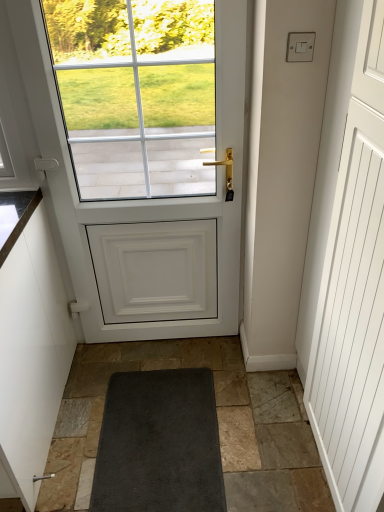
Question: Is white matte cabinet at left oriented away from white matte door at center?

Choices:
 (A) no
 (B) yes

Answer: (A)

Question: Is white matte cabinet at left behind white matte door at center?

Choices:
 (A) yes
 (B) no

Answer: (B)

Question: From a real-world perspective, is white matte cabinet at left positioned under white matte door at center based on gravity?

Choices:
 (A) yes
 (B) no

Answer: (A)

Question: Is white matte cabinet at left wider than white matte door at center?

Choices:
 (A) yes
 (B) no

Answer: (A)

Question: Is white matte cabinet at left placed right next to white matte door at center?

Choices:
 (A) yes
 (B) no

Answer: (B)

Question: Is white matte cabinet at left to the left or to the right of white matte door at center in the image?

Choices:
 (A) left
 (B) right

Answer: (A)

Question: Which is correct: white matte cabinet at left is inside white matte door at center, or outside of it?

Choices:
 (A) inside
 (B) outside

Answer: (B)

Question: Is white matte cabinet at left taller or shorter than white matte door at center?

Choices:
 (A) tall
 (B) short

Answer: (B)

Question: Looking at their shapes, would you say white matte cabinet at left is wider or thinner than white matte door at center?

Choices:
 (A) thin
 (B) wide

Answer: (B)

Question: Considering the positions of white matte door at center and white plastic switch at upper right in the image, is white matte door at center bigger or smaller than white plastic switch at upper right?

Choices:
 (A) big
 (B) small

Answer: (A)

Question: From their relative heights in the image, would you say white matte door at center is taller or shorter than white plastic switch at upper right?

Choices:
 (A) tall
 (B) short

Answer: (A)

Question: Considering the relative positions of white matte door at center and white plastic switch at upper right in the image provided, is white matte door at center to the left or to the right of white plastic switch at upper right?

Choices:
 (A) left
 (B) right

Answer: (A)

Question: From a real-world perspective, is white matte door at center above or below white plastic switch at upper right?

Choices:
 (A) above
 (B) below

Answer: (B)

Question: Considering their positions, is white plastic switch at upper right located in front of or behind white matte door at center?

Choices:
 (A) front
 (B) behind

Answer: (A)

Question: From a real-world perspective, is white plastic switch at upper right physically located above or below white matte door at center?

Choices:
 (A) above
 (B) below

Answer: (A)